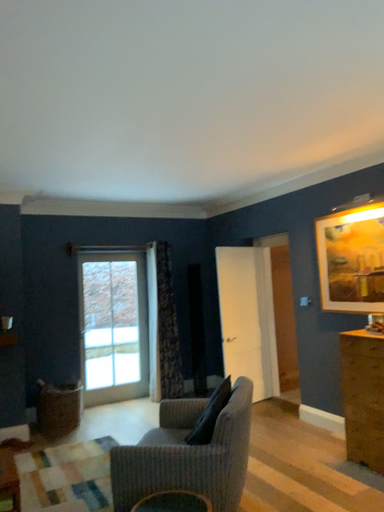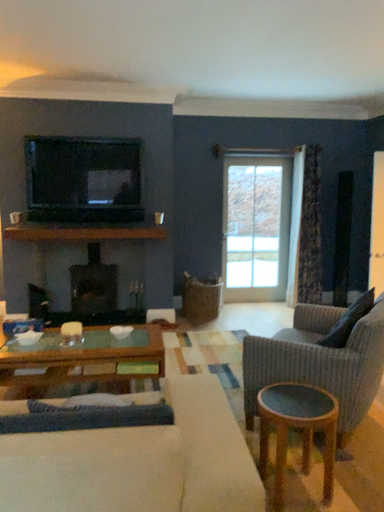
Question: Which way did the camera rotate in the video?

Choices:
 (A) rotated left
 (B) rotated right

Answer: (A)